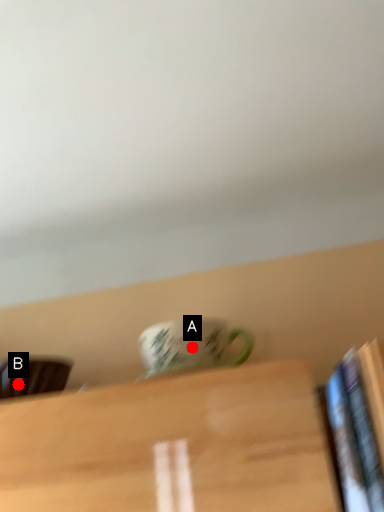
Question: Two points are circled on the image, labeled by A and B beside each circle. Which point appears closest to the camera in this image?

Choices:
 (A) A is closer
 (B) B is closer

Answer: (A)